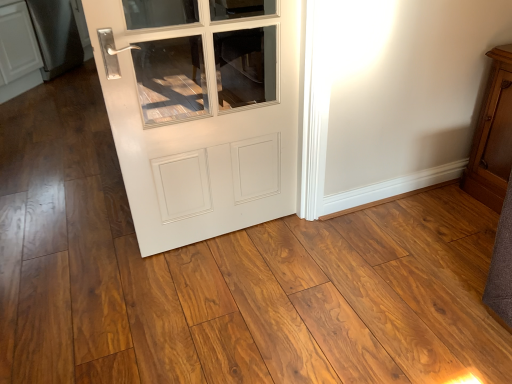
What do you see at coordinates (56, 36) in the screenshot? The width and height of the screenshot is (512, 384). I see `satin black refrigerator at left` at bounding box center [56, 36].

This screenshot has height=384, width=512. Find the location of `white glossy door at center`. white glossy door at center is located at coordinates pos(201,113).

Which is behind, white glossy door at center or wooden cabinet at right?

wooden cabinet at right is behind.

Is white glossy door at center not inside wooden cabinet at right?

Indeed, white glossy door at center is completely outside wooden cabinet at right.

Measure the distance from white glossy door at center to wooden cabinet at right.

They are 3.39 feet apart.

What's the angular difference between white glossy door at center and wooden cabinet at right's facing directions?

90.1 degrees.

From the image's perspective, is satin black refrigerator at left above or below white glossy door at center?

satin black refrigerator at left is above white glossy door at center.

Considering the sizes of objects satin black refrigerator at left and white glossy door at center in the image provided, who is smaller, satin black refrigerator at left or white glossy door at center?

With smaller size is white glossy door at center.

Consider the image. Considering the relative sizes of satin black refrigerator at left and white glossy door at center in the image provided, is satin black refrigerator at left taller than white glossy door at center?

No, satin black refrigerator at left is not taller than white glossy door at center.

In the scene shown: Can you confirm if satin black refrigerator at left is positioned to the left of white glossy door at center?

Indeed, satin black refrigerator at left is positioned on the left side of white glossy door at center.

Based on the photo, from the image's perspective, is wooden cabinet at right above or below satin black refrigerator at left?

wooden cabinet at right is situated lower than satin black refrigerator at left in the image.

Between wooden cabinet at right and satin black refrigerator at left, which one has larger size?

Bigger between the two is satin black refrigerator at left.

Is wooden cabinet at right situated inside satin black refrigerator at left or outside?

The correct answer is: outside.

Is wooden cabinet at right turned away from satin black refrigerator at left?

No, wooden cabinet at right's orientation is not away from satin black refrigerator at left.

Is wooden cabinet at right at the right side of white glossy door at center?

Correct, you'll find wooden cabinet at right to the right of white glossy door at center.

Is wooden cabinet at right turned away from white glossy door at center?

No, wooden cabinet at right's orientation is not away from white glossy door at center.

Considering the relative positions of wooden cabinet at right and white glossy door at center in the image provided, is wooden cabinet at right behind white glossy door at center?

Yes.

The width and height of the screenshot is (512, 384). What are the coordinates of `dresser that appears in front of the satin black refrigerator at left` in the screenshot? It's located at (492, 135).

Does point (33, 24) come closer to viewer compared to point (490, 132)?

No, (33, 24) is behind (490, 132).

From a real-world perspective, who is located higher, satin black refrigerator at left or wooden cabinet at right?

wooden cabinet at right is physically above.

Can we say white glossy door at center lies outside satin black refrigerator at left?

That's correct, white glossy door at center is outside of satin black refrigerator at left.

Would you say white glossy door at center is to the left or to the right of satin black refrigerator at left in the picture?

From the image, it's evident that white glossy door at center is to the right of satin black refrigerator at left.

Is point (296, 147) farther from camera compared to point (49, 52)?

No, (296, 147) is in front of (49, 52).

Considering the relative positions of white glossy door at center and satin black refrigerator at left in the image provided, is white glossy door at center behind satin black refrigerator at left?

No.

In order to click on door above the wooden cabinet at right (from a real-world perspective) in this screenshot , I will do pos(201,113).

You are a GUI agent. You are given a task and a screenshot of the screen. Output one action in this format:
    pyautogui.click(x=<x>, y=<y>)
    Task: Click on the appliance above the white glossy door at center (from the image's perspective)
    The width and height of the screenshot is (512, 384).
    Given the screenshot: What is the action you would take?
    pyautogui.click(x=56, y=36)

Considering their positions, is satin black refrigerator at left positioned closer to white glossy door at center than wooden cabinet at right?

wooden cabinet at right.

Consider the image. From the image, which object appears to be farther from satin black refrigerator at left, white glossy door at center or wooden cabinet at right?

The object further to satin black refrigerator at left is wooden cabinet at right.

Looking at the image, which one is located closer to wooden cabinet at right, satin black refrigerator at left or white glossy door at center?

Based on the image, white glossy door at center appears to be nearer to wooden cabinet at right.

Based on their spatial positions, is wooden cabinet at right or satin black refrigerator at left further from white glossy door at center?

satin black refrigerator at left is further to white glossy door at center.

When comparing their distances from satin black refrigerator at left, does wooden cabinet at right or white glossy door at center seem closer?

white glossy door at center is positioned closer to the anchor satin black refrigerator at left.

Based on their spatial positions, is white glossy door at center or satin black refrigerator at left closer to wooden cabinet at right?

white glossy door at center is positioned closer to the anchor wooden cabinet at right.

What are the coordinates of `door between satin black refrigerator at left and wooden cabinet at right in the horizontal direction` in the screenshot? It's located at (201, 113).